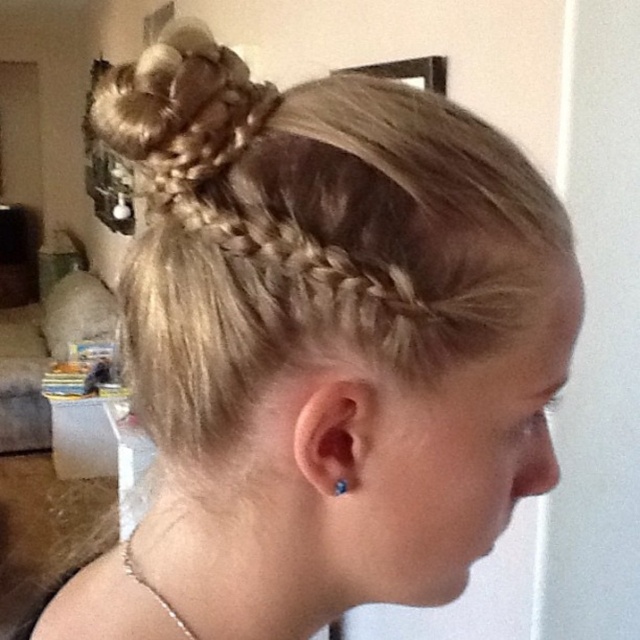
You are taking a photo of a hairstyle and want to focus on the point closer to the camera. Which point should you focus on between point (113,93) and point (346,490)?

Point (113,93) is further to the camera than point (346,490). Therefore, you should focus on point (113,93) to capture the closer point in your photo.

You are a photographer setting up for a portrait session. The subject is wearing a silver chain necklace at lower left. You want to ensure the necklace is clearly visible in the photo. Based on its distance from the viewer, is the necklace positioned close enough to be in focus without needing to adjust the camera focus manually?

The silver chain necklace at lower left is 14.13 inches from the viewer. Since this distance is within typical camera focus range for portraits, the necklace should be in focus without needing manual adjustments.